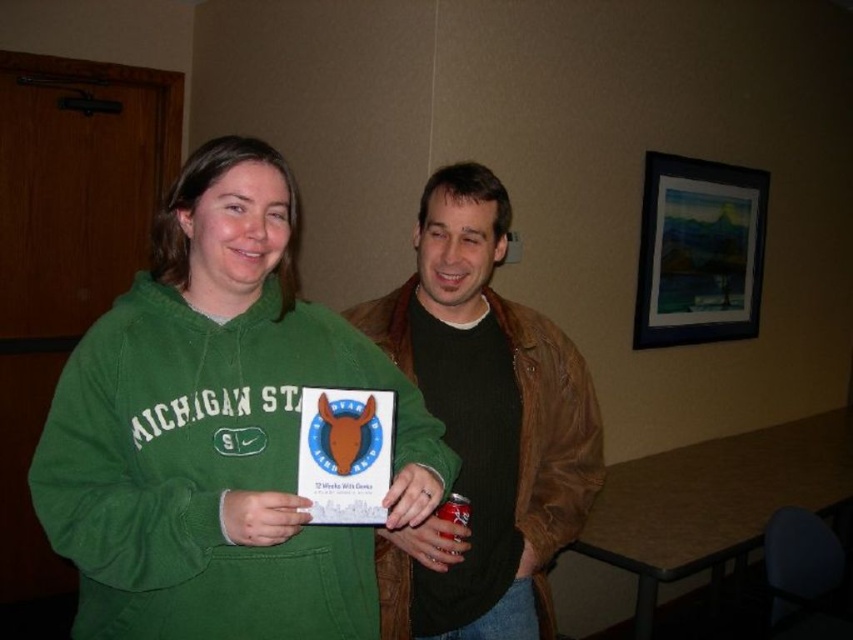
Question: Considering the relative positions of green fleece sweatshirt at center and brown leather jacket at center in the image provided, where is green fleece sweatshirt at center located with respect to brown leather jacket at center?

Choices:
 (A) right
 (B) left

Answer: (B)

Question: Can you confirm if green fleece sweatshirt at center is positioned below brown leather jacket at center?

Choices:
 (A) no
 (B) yes

Answer: (A)

Question: Which point appears farthest from the camera in this image?

Choices:
 (A) (289, 403)
 (B) (517, 470)

Answer: (B)

Question: Considering the relative positions of green fleece sweatshirt at center and brown leather jacket at center in the image provided, where is green fleece sweatshirt at center located with respect to brown leather jacket at center?

Choices:
 (A) above
 (B) below

Answer: (A)